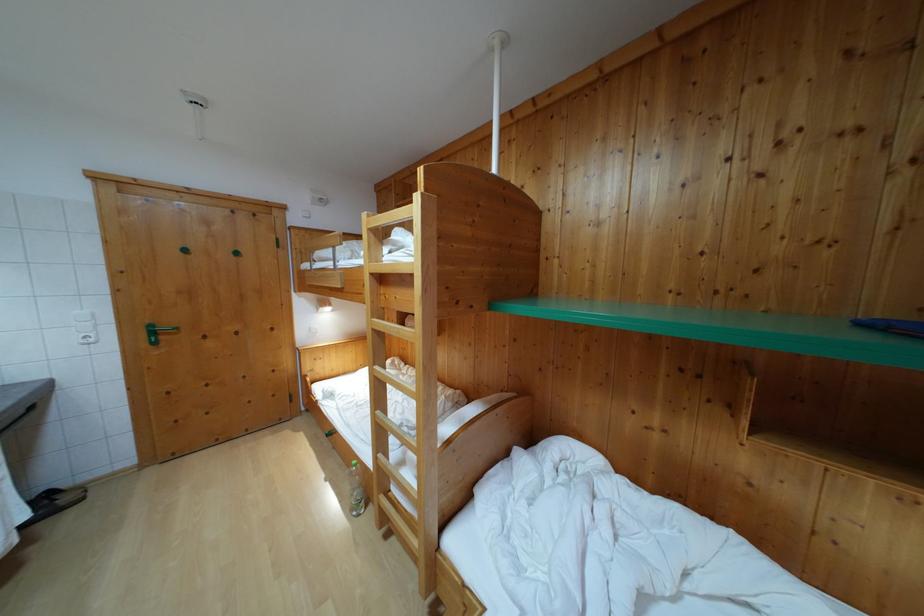
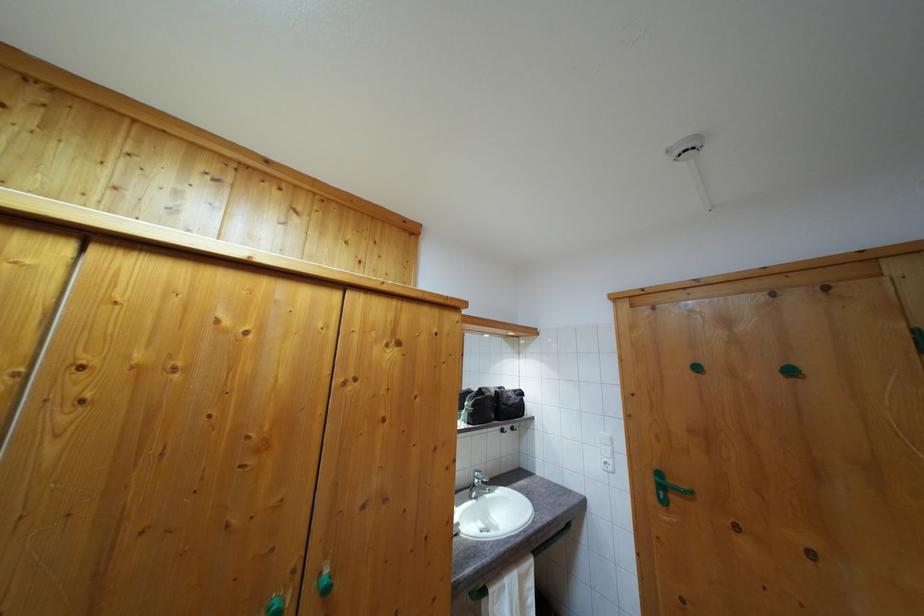
In the second image, find the point that corresponds to point 157,339 in the first image.

(664, 493)